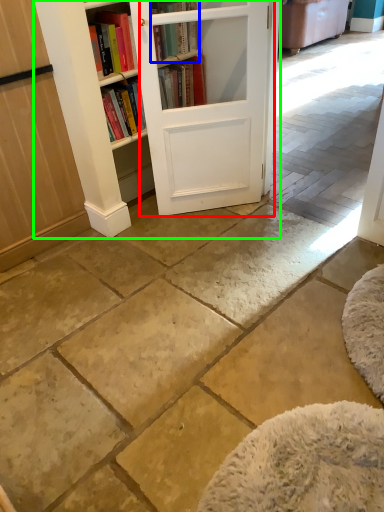
Question: Estimate the real-world distances between objects in this image. Which object is farther from barn door (highlighted by a red box), book (highlighted by a blue box) or bookcase (highlighted by a green box)?

Choices:
 (A) book
 (B) bookcase

Answer: (B)